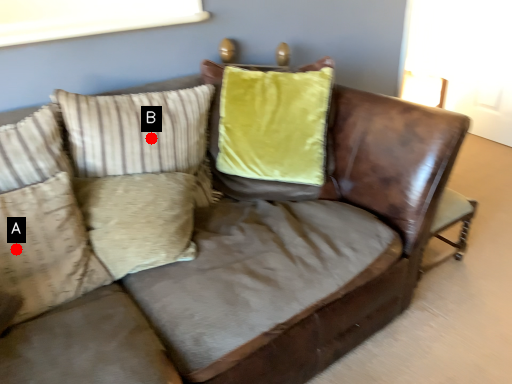
Question: Two points are circled on the image, labeled by A and B beside each circle. Which point is closer to the camera?

Choices:
 (A) A is closer
 (B) B is closer

Answer: (A)